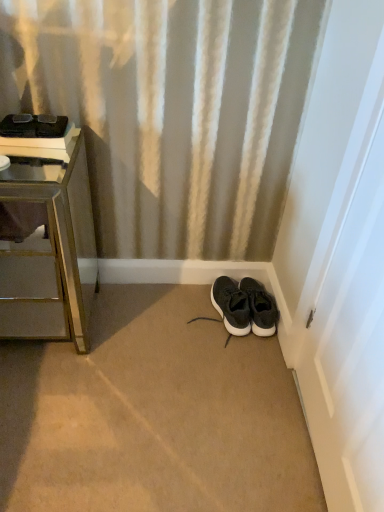
Question: Considering the relative sizes of black suede sneakers at lower right, the second footwear when ordered from left to right, and black fabric sneakers at center, acting as the 2th footwear starting from the right, in the image provided, is black suede sneakers at lower right, the second footwear when ordered from left to right, smaller than black fabric sneakers at center, acting as the 2th footwear starting from the right,?

Choices:
 (A) yes
 (B) no

Answer: (A)

Question: Is black suede sneakers at lower right, the second footwear when ordered from left to right, further to camera compared to black fabric sneakers at center, the first footwear viewed from the left?

Choices:
 (A) no
 (B) yes

Answer: (B)

Question: Is black fabric sneakers at center, the first footwear viewed from the left, located within black suede sneakers at lower right, which is counted as the 1th footwear, starting from the right?

Choices:
 (A) yes
 (B) no

Answer: (B)

Question: Is black fabric sneakers at center, the first footwear viewed from the left, at the back of black suede sneakers at lower right, the second footwear when ordered from left to right?

Choices:
 (A) yes
 (B) no

Answer: (B)

Question: Would you say black suede sneakers at lower right, which is counted as the 1th footwear, starting from the right, is a long distance from black fabric sneakers at center, acting as the 2th footwear starting from the right?

Choices:
 (A) no
 (B) yes

Answer: (A)

Question: From a real-world perspective, is black suede sneakers at lower right, the second footwear when ordered from left to right, on top of black fabric sneakers at center, acting as the 2th footwear starting from the right?

Choices:
 (A) no
 (B) yes

Answer: (A)

Question: From a real-world perspective, is black fabric sneakers at center, the first footwear viewed from the left, beneath black suede sneakers at lower right, which is counted as the 1th footwear, starting from the right?

Choices:
 (A) yes
 (B) no

Answer: (B)

Question: Is black fabric sneakers at center, acting as the 2th footwear starting from the right, not close to black suede sneakers at lower right, which is counted as the 1th footwear, starting from the right?

Choices:
 (A) no
 (B) yes

Answer: (A)

Question: Is black fabric sneakers at center, the first footwear viewed from the left, looking in the opposite direction of black suede sneakers at lower right, which is counted as the 1th footwear, starting from the right?

Choices:
 (A) yes
 (B) no

Answer: (B)

Question: Is black suede sneakers at lower right, which is counted as the 1th footwear, starting from the right, a part of black fabric sneakers at center, acting as the 2th footwear starting from the right?

Choices:
 (A) yes
 (B) no

Answer: (B)

Question: Are black fabric sneakers at center, the first footwear viewed from the left, and black suede sneakers at lower right, which is counted as the 1th footwear, starting from the right, making contact?

Choices:
 (A) no
 (B) yes

Answer: (B)

Question: Does black fabric sneakers at center, the first footwear viewed from the left, have a greater width compared to black suede sneakers at lower right, the second footwear when ordered from left to right?

Choices:
 (A) yes
 (B) no

Answer: (A)

Question: Is there a large distance between brushed metal nightstand at left and black fabric sneakers at center, acting as the 2th footwear starting from the right?

Choices:
 (A) no
 (B) yes

Answer: (A)